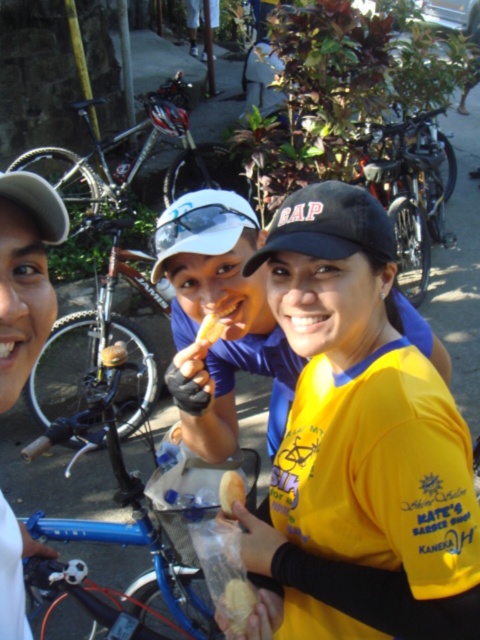
Does yellow fabric shirt at center have a larger size compared to silver metallic bicycle at upper left?

Actually, yellow fabric shirt at center might be smaller than silver metallic bicycle at upper left.

What do you see at coordinates (360, 442) in the screenshot? I see `yellow fabric shirt at center` at bounding box center [360, 442].

Find the location of a particular element. yellow fabric shirt at center is located at coordinates click(360, 442).

Is blue metallic bicycle at center smaller than brushed metal bicycle at left?

Indeed, blue metallic bicycle at center has a smaller size compared to brushed metal bicycle at left.

Between blue metallic bicycle at center and brushed metal bicycle at left, which one appears on the right side from the viewer's perspective?

blue metallic bicycle at center is more to the right.

Which is behind, point (41, 598) or point (96, 221)?

The point (96, 221) is behind.

The width and height of the screenshot is (480, 640). In order to click on blue metallic bicycle at center in this screenshot , I will do `click(137, 577)`.

Who is lower down, white matte cap at upper left or golden brown crumbly pastry at center?

white matte cap at upper left is lower down.

Does white matte cap at upper left have a larger size compared to golden brown crumbly pastry at center?

Yes.

Does point (12, 323) lie in front of point (222, 500)?

Yes, it is in front of point (222, 500).

This screenshot has height=640, width=480. Identify the location of white matte cap at upper left. (25, 275).